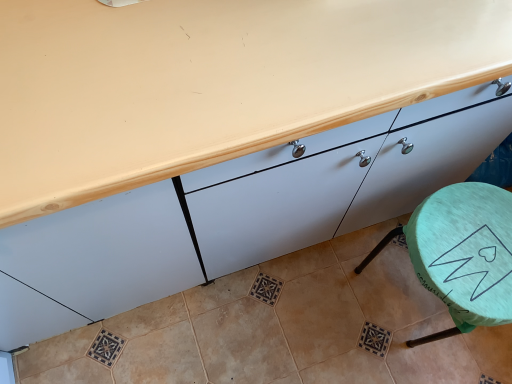
I want to click on vacant space underneath green fabric stool at lower right (from a real-world perspective), so click(x=402, y=299).